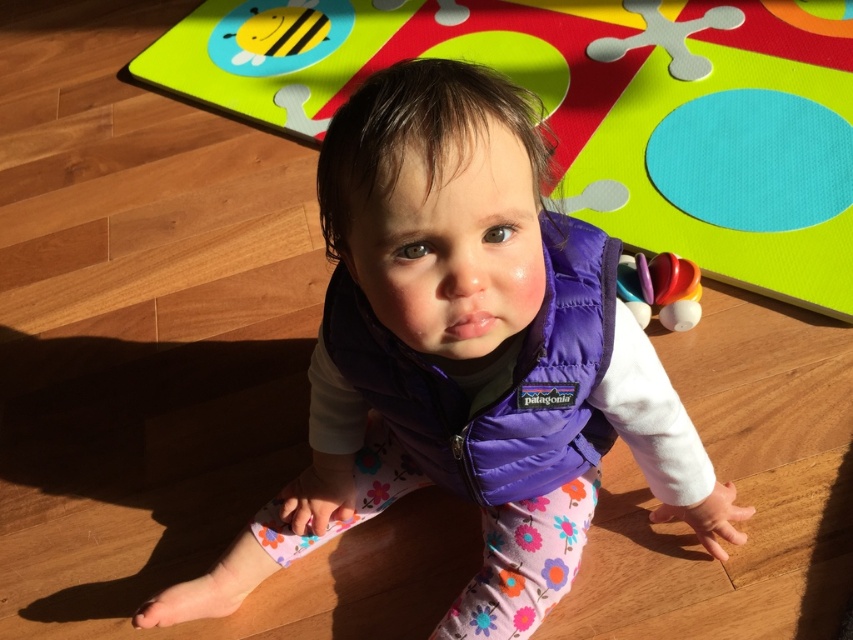
Question: From the image, what is the correct spatial relationship of purple down vest at center in relation to smooth plastic toy at right?

Choices:
 (A) left
 (B) right

Answer: (A)

Question: Which point is farther to the camera?

Choices:
 (A) smooth plastic toy at right
 (B) purple down vest at center

Answer: (A)

Question: Considering the relative positions of purple down vest at center and smooth plastic toy at right in the image provided, where is purple down vest at center located with respect to smooth plastic toy at right?

Choices:
 (A) below
 (B) above

Answer: (A)

Question: Is purple down vest at center thinner than multicolored foam mat at upper center?

Choices:
 (A) no
 (B) yes

Answer: (B)

Question: Among these points, which one is nearest to the camera?

Choices:
 (A) (674, 291)
 (B) (358, 227)

Answer: (B)

Question: Among these objects, which one is nearest to the camera?

Choices:
 (A) multicolored foam mat at upper center
 (B) smooth plastic toy at right
 (C) purple down vest at center

Answer: (C)